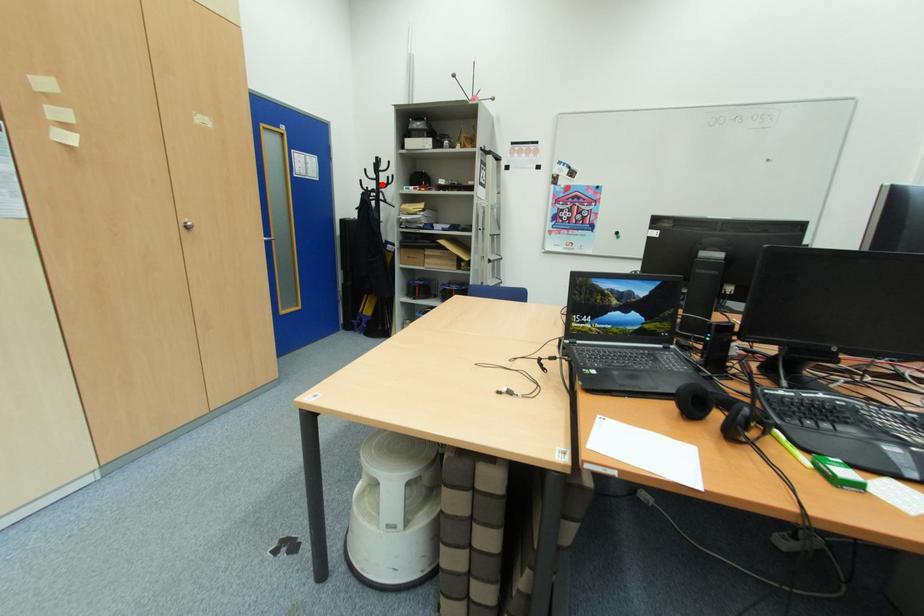
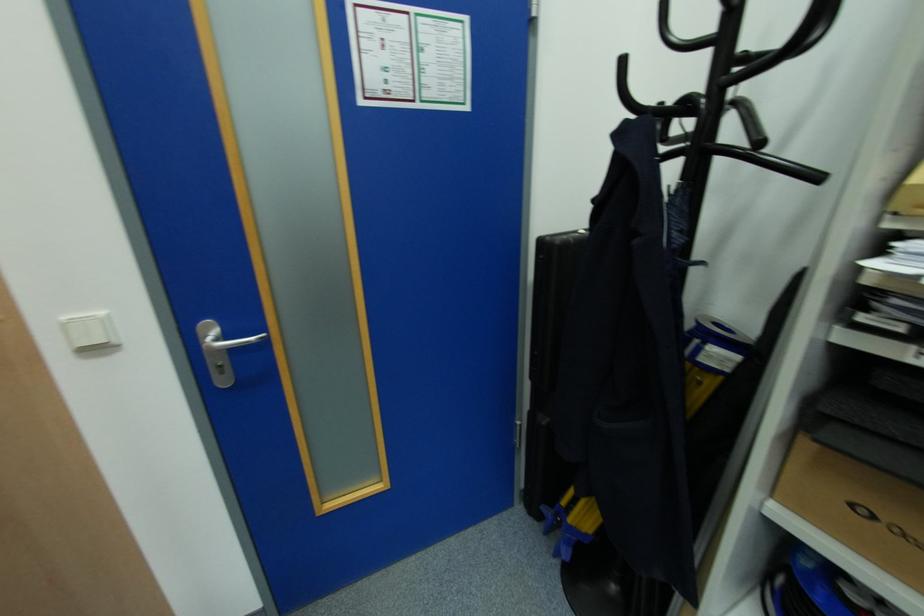
Question: I am providing you with two images of the same scene from different viewpoints. A red point is shown in image1. For the corresponding object point in image2, is it positioned nearer or farther from the camera?

Choices:
 (A) Nearer
 (B) Farther

Answer: (B)